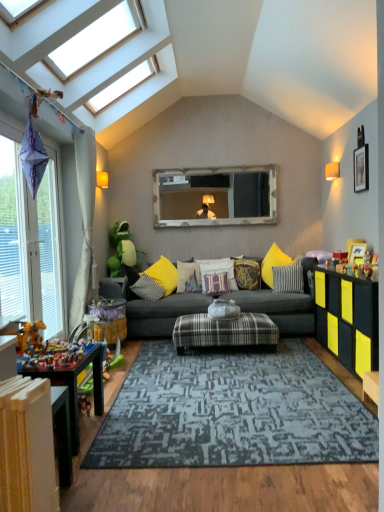
Where is `vacant area situated below wooden frame mirror at center (from a real-world perspective)`? The width and height of the screenshot is (384, 512). vacant area situated below wooden frame mirror at center (from a real-world perspective) is located at coordinates (219, 256).